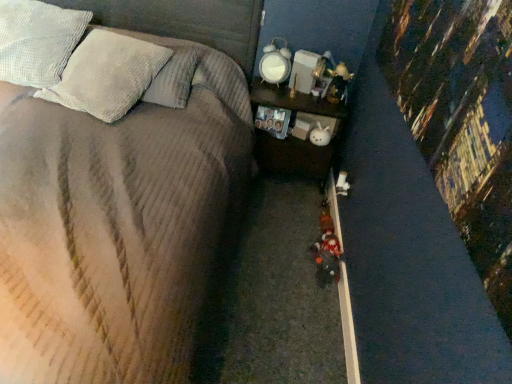
Identify the location of blank space situated above smooth concrete curb at lower right (from a real-world perspective). (341, 253).